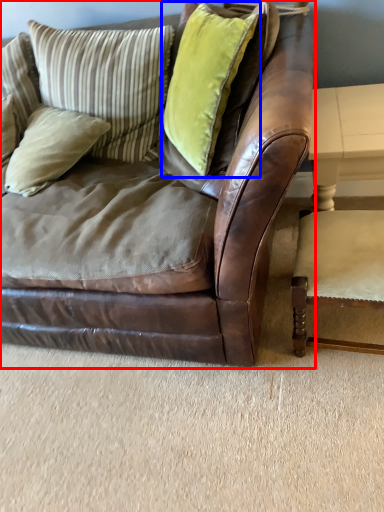
Question: Among these objects, which one is nearest to the camera, studio couch (highlighted by a red box) or pillow (highlighted by a blue box)?

Choices:
 (A) studio couch
 (B) pillow

Answer: (A)